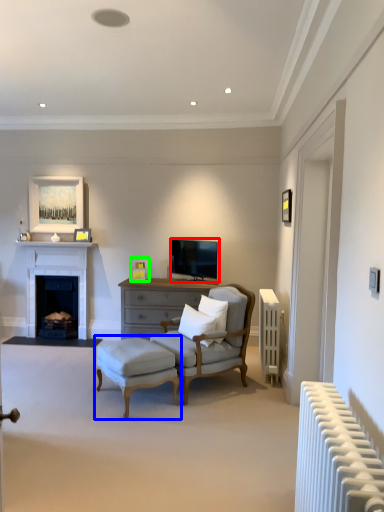
Question: Based on their relative distances, which object is farther from television (highlighted by a red box)? Choose from table (highlighted by a blue box) and picture frame (highlighted by a green box).

Choices:
 (A) table
 (B) picture frame

Answer: (A)